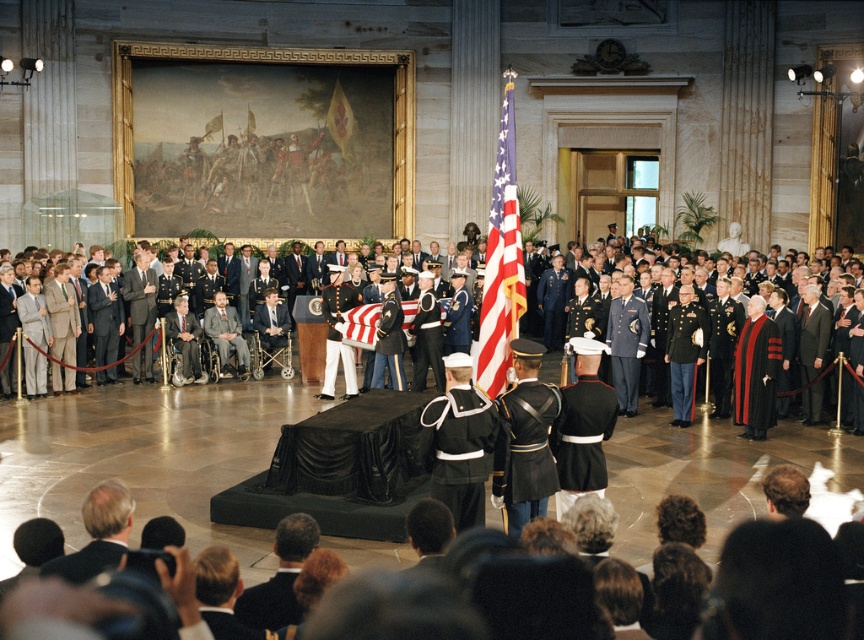
Question: Can you confirm if american flag at center is wider than dark suit at lower left?

Choices:
 (A) yes
 (B) no

Answer: (A)

Question: Is american flag at center wider than red flag at upper center?

Choices:
 (A) yes
 (B) no

Answer: (B)

Question: Which object appears closest to the camera in this image?

Choices:
 (A) dark suit at lower left
 (B) black glossy uniform at center
 (C) shiny black uniform at center
 (D) dark brown suit at lower center

Answer: (D)

Question: Is black glossy uniform at center to the right of dark brown suit at lower center from the viewer's perspective?

Choices:
 (A) yes
 (B) no

Answer: (A)

Question: Which of these objects is positioned farthest from the dark brown suit at lower center?

Choices:
 (A) shiny black uniform at center
 (B) dark suit at lower left
 (C) black glossy uniform at center
 (D) red flag at upper center

Answer: (D)

Question: Which of the following is the farthest from the observer?

Choices:
 (A) (532, 481)
 (B) (478, 433)

Answer: (A)